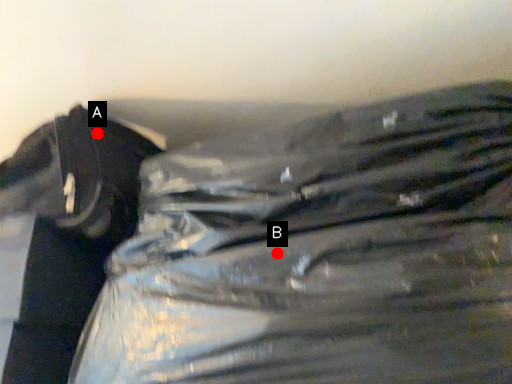
Question: Two points are circled on the image, labeled by A and B beside each circle. Which point is farther to the camera?

Choices:
 (A) A is further
 (B) B is further

Answer: (A)